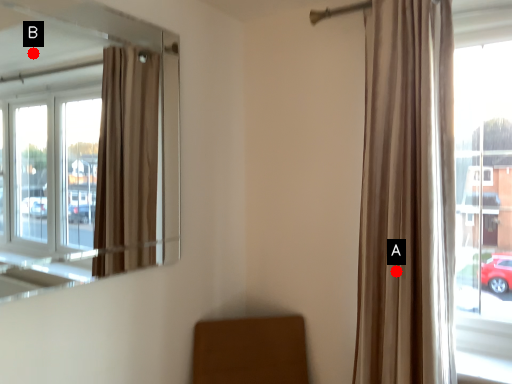
Question: Two points are circled on the image, labeled by A and B beside each circle. Among these points, which one is farthest from the camera?

Choices:
 (A) A is further
 (B) B is further

Answer: (B)